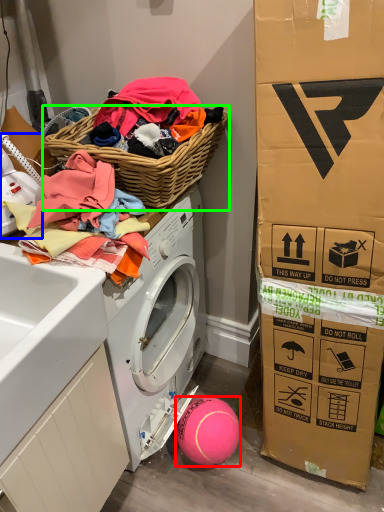
Question: Which object is the farthest from ball (highlighted by a red box)? Choose among these: washer (highlighted by a blue box) or picnic basket (highlighted by a green box).

Choices:
 (A) washer
 (B) picnic basket

Answer: (A)